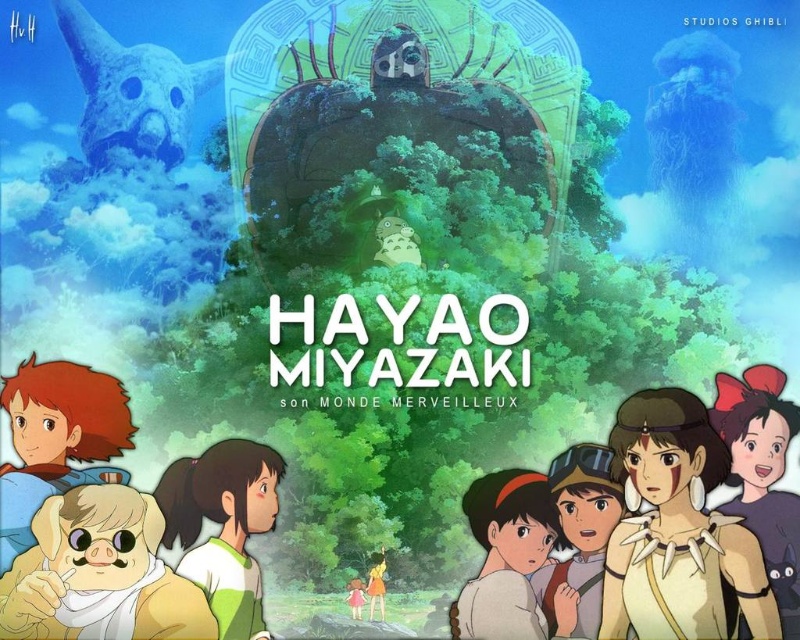
Can you confirm if soft yellow fur at lower left is positioned to the right of smooth brown jacket at center?

In fact, soft yellow fur at lower left is to the left of smooth brown jacket at center.

How far apart are soft yellow fur at lower left and smooth brown jacket at center?

A distance of 13.21 meters exists between soft yellow fur at lower left and smooth brown jacket at center.

Is point (165, 564) behind point (568, 563)?

No, (165, 564) is closer to viewer.

Locate an element on the screen. soft yellow fur at lower left is located at coordinates (100, 573).

Measure the distance from green matte shirt at center to smooth beige dress at center.

green matte shirt at center is 3.34 meters away from smooth beige dress at center.

Who is more distant from viewer, (174, 492) or (348, 584)?

A: Point (174, 492)

The width and height of the screenshot is (800, 640). What are the coordinates of `green matte shirt at center` in the screenshot? It's located at (224, 525).

Consider the image. Is soft yellow fur at lower left closer to the viewer compared to golden hair at lower center?

That is True.

Does point (130, 630) come farther from viewer compared to point (368, 592)?

No, (130, 630) is closer to viewer.

You are a GUI agent. You are given a task and a screenshot of the screen. Output one action in this format:
    pyautogui.click(x=<x>, y=<y>)
    Task: Click on the soft yellow fur at lower left
    This screenshot has width=800, height=640.
    Given the screenshot: What is the action you would take?
    pyautogui.click(x=100, y=573)

Where is `soft yellow fur at lower left`? soft yellow fur at lower left is located at coordinates (100, 573).